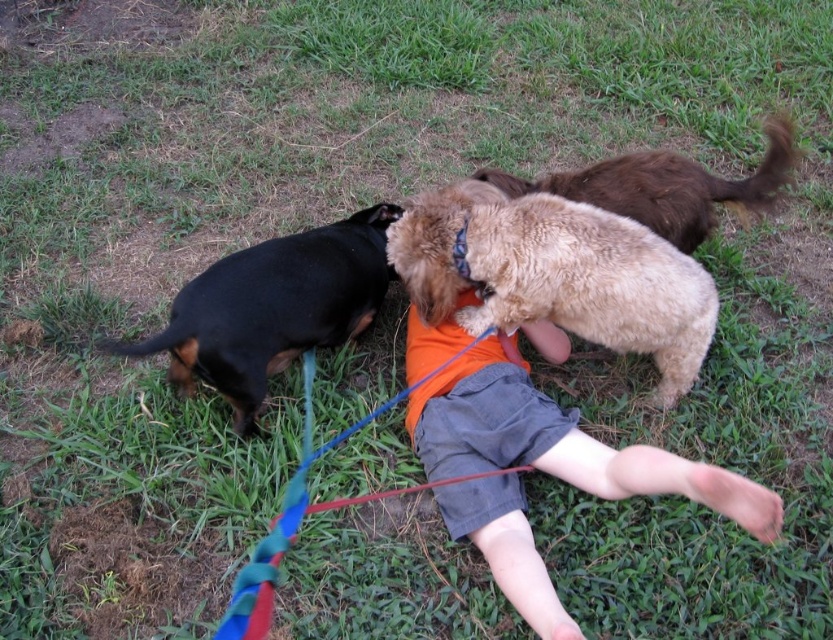
What is located at the coordinates point (557, 442)?

The point (557, 442) indicates the orange tshirt at center.

You are a photographer trying to capture a photo of the black smooth coat dog at left and the fuzzy beige dog at center. Since you want to focus on both dogs clearly, which dog should you position closer to the camera to ensure both are in focus?

The black smooth coat dog at left is behind the fuzzy beige dog at center, so to have both in focus, you should move the black smooth coat dog at left forward so it is closer to the camera than the fuzzy beige dog at center.

Based on the scene, which dog is taller between the fuzzy beige dog at center and the black smooth coat dog at left?

The black smooth coat dog at left is taller than the fuzzy beige dog at center.